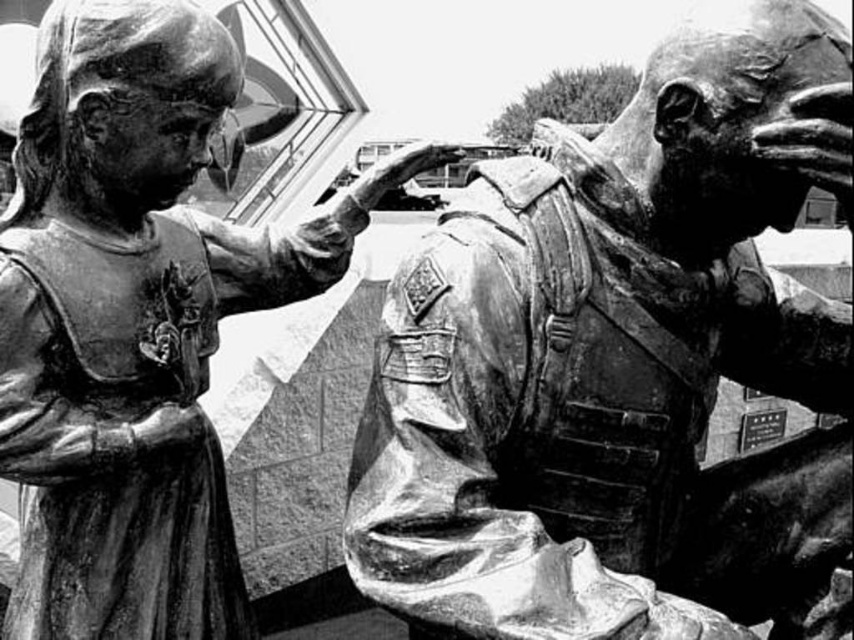
Does bronze soldier at center appear under bronze statue at center?

Yes.

Measure the distance between bronze soldier at center and camera.

bronze soldier at center is 9.32 feet away from camera.

I want to click on bronze soldier at center, so click(616, 365).